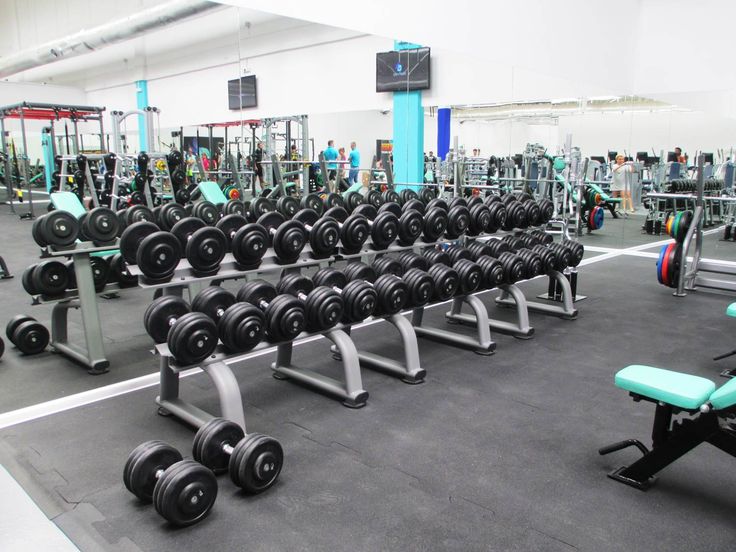
In order to click on individual mirrors in this screenshot , I will do `click(606, 140)`, `click(656, 140)`, `click(686, 146)`, `click(537, 135)`, `click(489, 135)`, `click(380, 145)`.